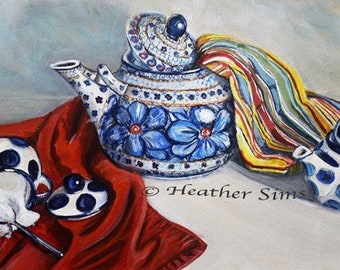
The width and height of the screenshot is (340, 270). In order to click on art work in this screenshot , I will do `click(177, 142)`.